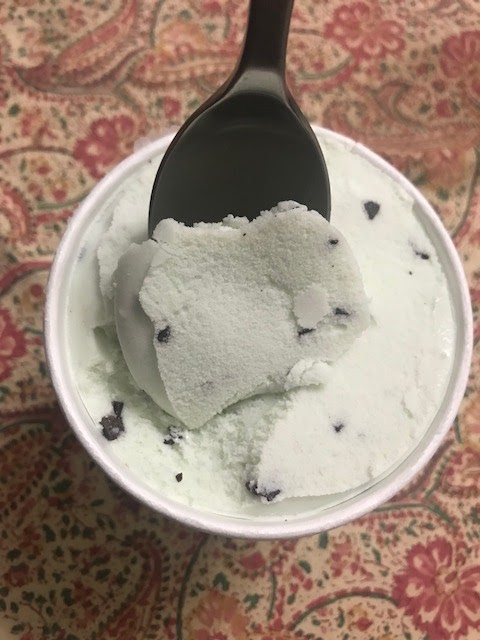
Where is `brown spoon`? Image resolution: width=480 pixels, height=640 pixels. brown spoon is located at coordinates (258, 70).